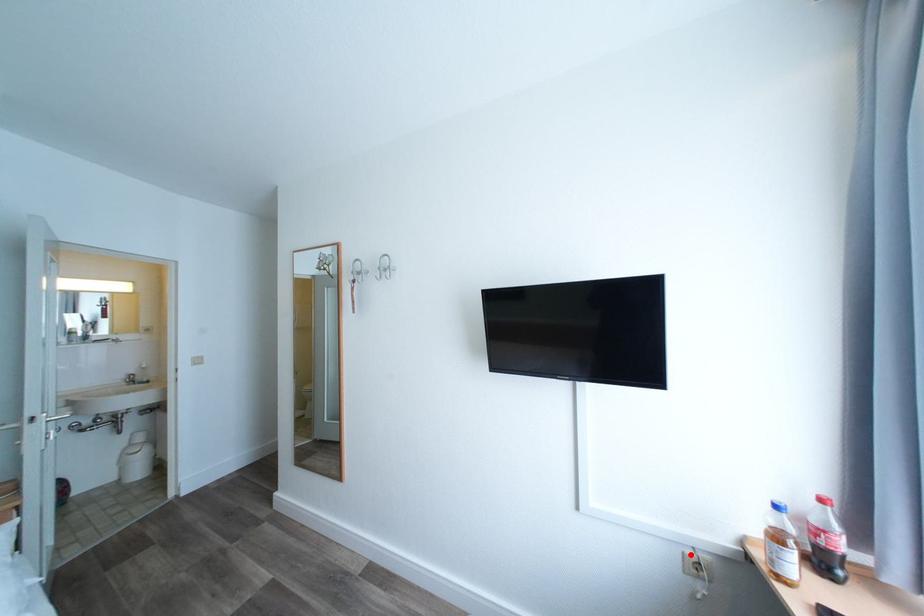
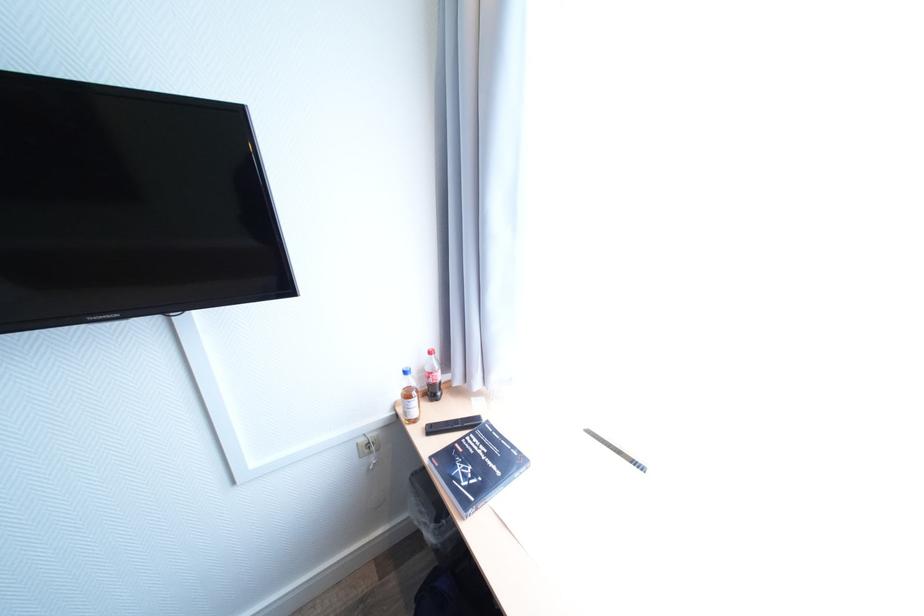
Locate, in the second image, the point that corresponds to the highlighted location in the first image.

(365, 445)